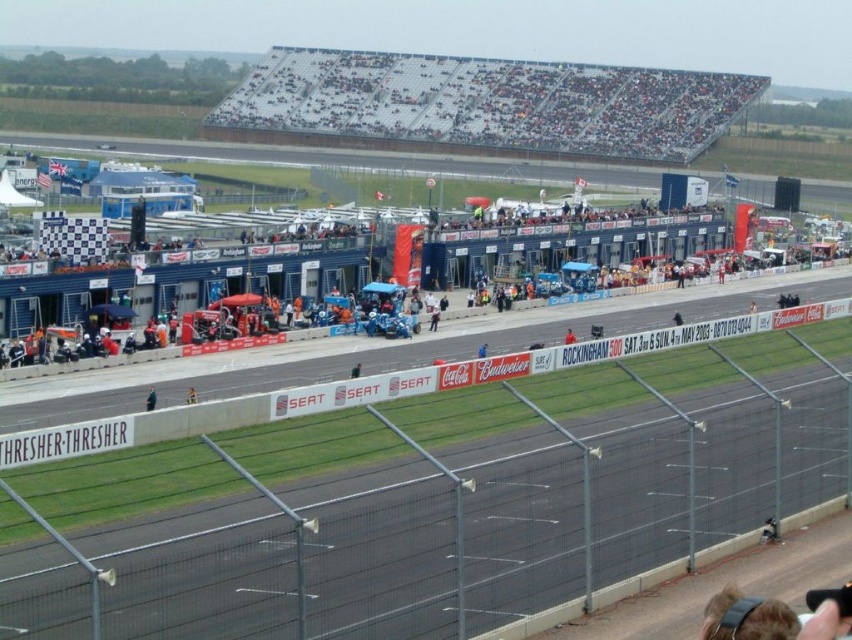
Question: Which of these objects is positioned farthest from the black fabric person at lower left?

Choices:
 (A) black asphalt race track at center
 (B) dark gray seats at upper center
 (C) red fabric person at center

Answer: (B)

Question: Which of the following is the closest to the observer?

Choices:
 (A) black leather jacket at lower right
 (B) dark gray seats at upper center
 (C) black asphalt race track at center
 (D) red fabric person at center

Answer: (C)

Question: Is black fabric person at lower left in front of red fabric person at center?

Choices:
 (A) no
 (B) yes

Answer: (B)

Question: Is black leather jacket at lower right positioned before red fabric person at center?

Choices:
 (A) no
 (B) yes

Answer: (B)

Question: Which of the following is the farthest from the observer?

Choices:
 (A) black asphalt race track at center
 (B) light brown wooden chair at center
 (C) black leather jacket at lower right
 (D) blue fabric person at center

Answer: (D)

Question: Does black fabric person at lower left have a lesser width compared to blue fabric person at center?

Choices:
 (A) yes
 (B) no

Answer: (B)